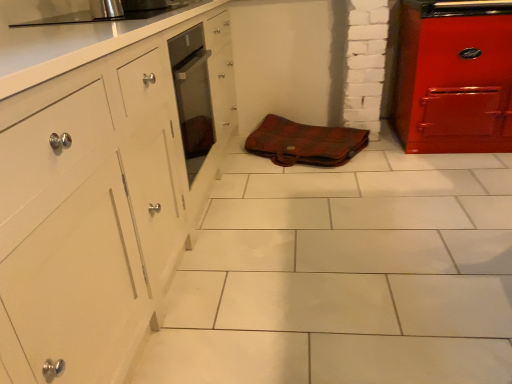
Question: Based on their positions, is brushed metal oven at upper center located to the left or right of brown leather bag at center?

Choices:
 (A) left
 (B) right

Answer: (A)

Question: Considering their positions, is brushed metal oven at upper center located in front of or behind brown leather bag at center?

Choices:
 (A) behind
 (B) front

Answer: (B)

Question: In terms of height, does brushed metal oven at upper center look taller or shorter compared to brown leather bag at center?

Choices:
 (A) tall
 (B) short

Answer: (A)

Question: From the image's perspective, is brown leather bag at center located above or below brushed metal oven at upper center?

Choices:
 (A) below
 (B) above

Answer: (A)

Question: Considering the positions of brown leather bag at center and brushed metal oven at upper center in the image, is brown leather bag at center taller or shorter than brushed metal oven at upper center?

Choices:
 (A) short
 (B) tall

Answer: (A)

Question: From a real-world perspective, relative to brushed metal oven at upper center, is brown leather bag at center vertically above or below?

Choices:
 (A) below
 (B) above

Answer: (A)

Question: Does point (337, 160) appear closer or farther from the camera than point (114, 6)?

Choices:
 (A) farther
 (B) closer

Answer: (A)